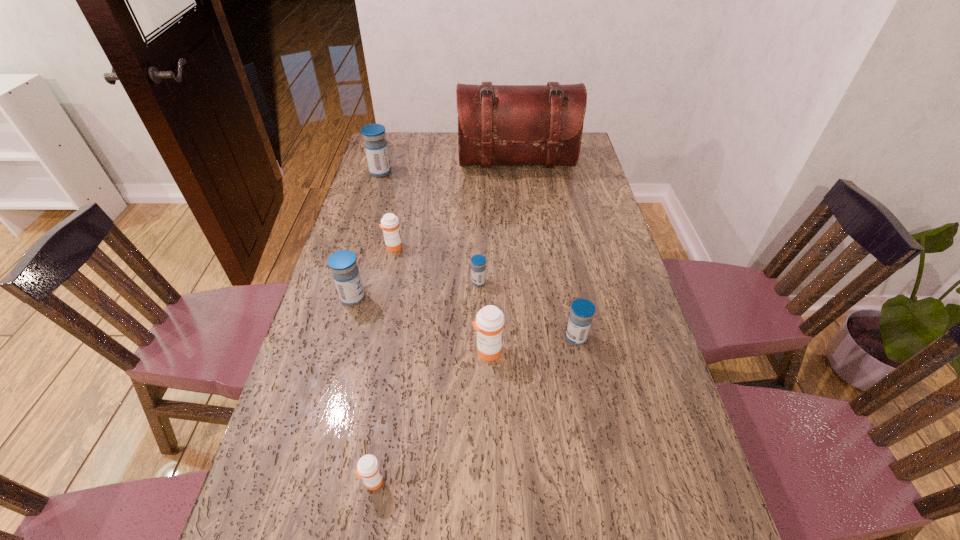
Find the location of a particular element. The width and height of the screenshot is (960, 540). free space that is in between the fourth nearest medicine and the tallest object is located at coordinates (435, 231).

The height and width of the screenshot is (540, 960). In order to click on free space between the biggest blue medicine and the fourth nearest medicine in this screenshot , I will do `click(367, 235)`.

Locate an element on the screen. empty space between the second blue medicine from right to left and the nearest object is located at coordinates (426, 382).

Locate an element on the screen. The image size is (960, 540). free space between the rightmost medicine and the nearest object is located at coordinates pyautogui.click(x=474, y=409).

Find the location of `vacant space that's between the third farthest medicine and the biggest blue medicine`. vacant space that's between the third farthest medicine and the biggest blue medicine is located at coordinates (430, 227).

At what (x,y) coordinates should I click in order to perform the action: click on free space between the nearest blue medicine and the fifth nearest medicine. Please return your answer as a coordinate pair (x, y). The image size is (960, 540). Looking at the image, I should click on (527, 310).

Find the location of a particular element. vacant region between the satchel and the second blue medicine from right to left is located at coordinates (497, 223).

Identify the location of free space between the second farthest orange medicine and the farthest medicine. The width and height of the screenshot is (960, 540). (434, 261).

The image size is (960, 540). Identify the location of free space between the brown satchel and the rightmost orange medicine. (502, 257).

Identify the location of free space between the second blue medicine from right to left and the rightmost blue medicine. This screenshot has height=540, width=960. (527, 310).